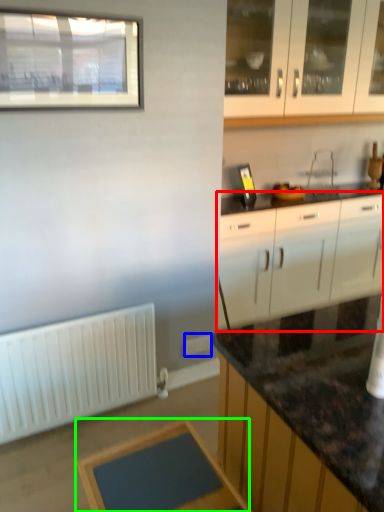
Question: Estimate the real-world distances between objects in this image. Which object is closer to cabinetry (highlighted by a red box), electric outlet (highlighted by a blue box) or table (highlighted by a green box)?

Choices:
 (A) electric outlet
 (B) table

Answer: (A)